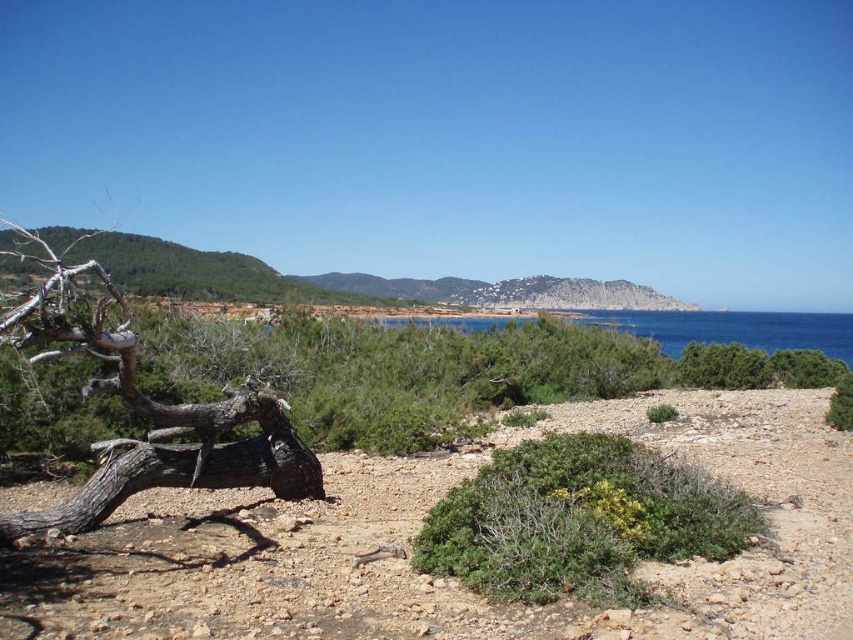
You are standing on the brown rocky beach at lower center and want to reach the green shrub at center to pick a leaf. Which direction should you move to get there?

You should move to the left because the brown rocky beach at lower center is to the right of the green shrub at center, so moving left will take you towards the shrub.

You are a hiker navigating the coastal landscape and want to move from the point marked at coordinates point (352,572) to the point marked at coordinates point (260,406). Considering the terrain described, will you encounter the large twisted tree trunk lying horizontally across the scene before reaching your destination?

Yes, you will encounter the large twisted tree trunk lying horizontally across the scene before reaching point (260,406) because point (352,572) is in front of point (260,406) according to the coordinates provided.